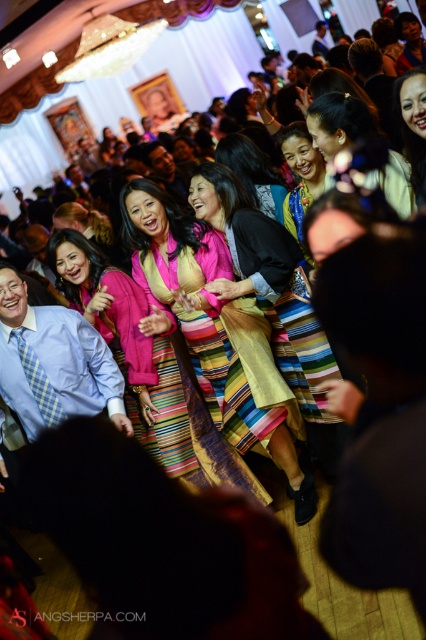
Question: Which point is farther to the camera?

Choices:
 (A) silky pink dress at center
 (B) multicolored woven dress at center

Answer: (B)

Question: Does matte pink fabric dress at center have a lesser width compared to multicolored woven dress at center?

Choices:
 (A) no
 (B) yes

Answer: (A)

Question: Which point appears closest to the camera in this image?

Choices:
 (A) click(x=405, y=192)
 (B) click(x=229, y=216)
 (C) click(x=420, y=68)
 (D) click(x=83, y=294)

Answer: (C)

Question: From the image, what is the correct spatial relationship of matte pink fabric dress at center in relation to multicolored woven dress at center?

Choices:
 (A) below
 (B) above

Answer: (A)

Question: Which of these objects is positioned farthest from the matte yellow dress at center?

Choices:
 (A) multicolored woven skirt at center
 (B) silky pink dress at center

Answer: (A)

Question: Is matte pink fabric dress at center smaller than silky pink dress at center?

Choices:
 (A) yes
 (B) no

Answer: (B)